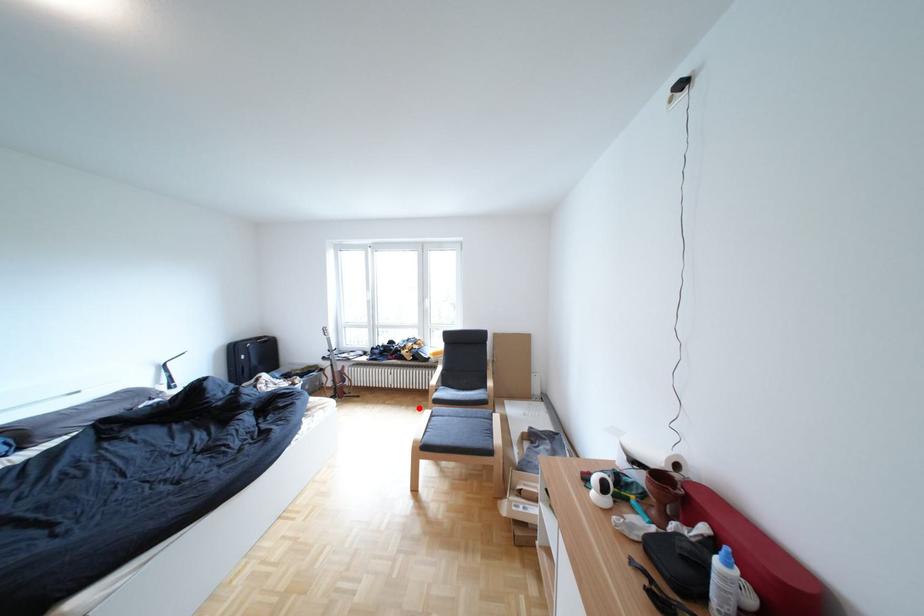
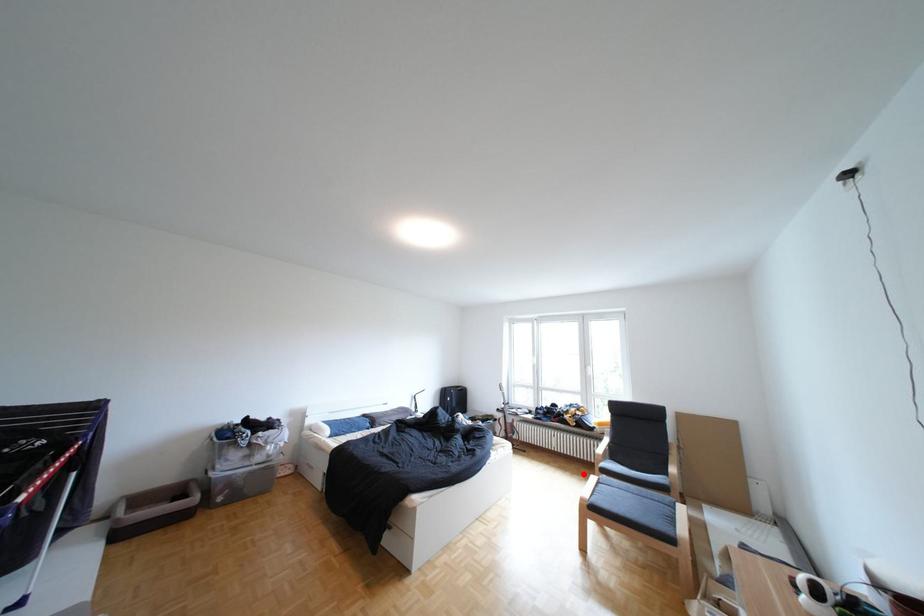
From the picture: I am providing you with two images of the same scene from different viewpoints. A red point is marked on the first image and another point is marked on the second image. Is the red point in image1 aligned with the point shown in image2?

Yes